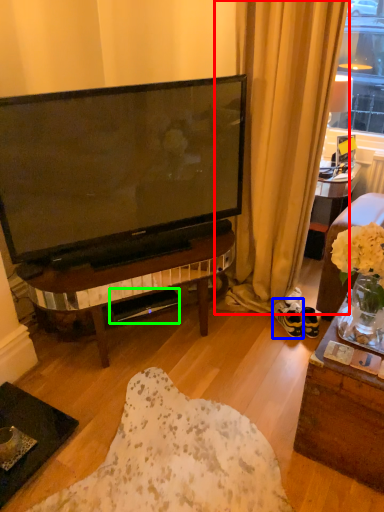
Question: Based on their relative distances, which object is farther from curtain (highlighted by a red box)? Choose from footwear (highlighted by a blue box) and loudspeaker (highlighted by a green box).

Choices:
 (A) footwear
 (B) loudspeaker

Answer: (B)